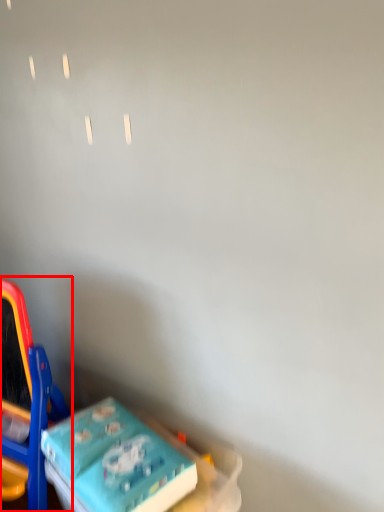
Question: In this image, where is toy (annotated by the red box) located relative to toy?

Choices:
 (A) right
 (B) left

Answer: (B)